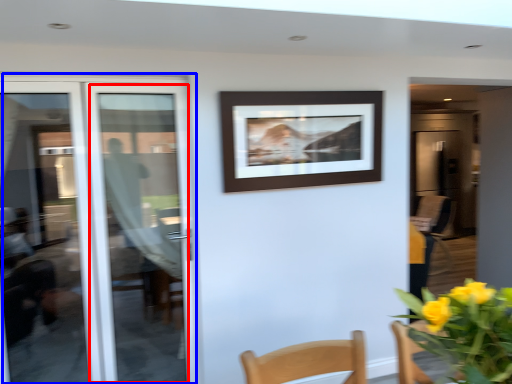
Question: Among these objects, which one is farthest to the camera, door (highlighted by a red box) or door (highlighted by a blue box)?

Choices:
 (A) door
 (B) door

Answer: (A)